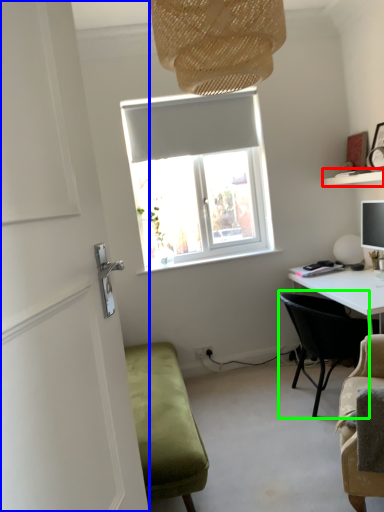
Question: Which object is the farthest from shelf (highlighted by a red box)? Choose among these: door (highlighted by a blue box) or chair (highlighted by a green box).

Choices:
 (A) door
 (B) chair

Answer: (A)